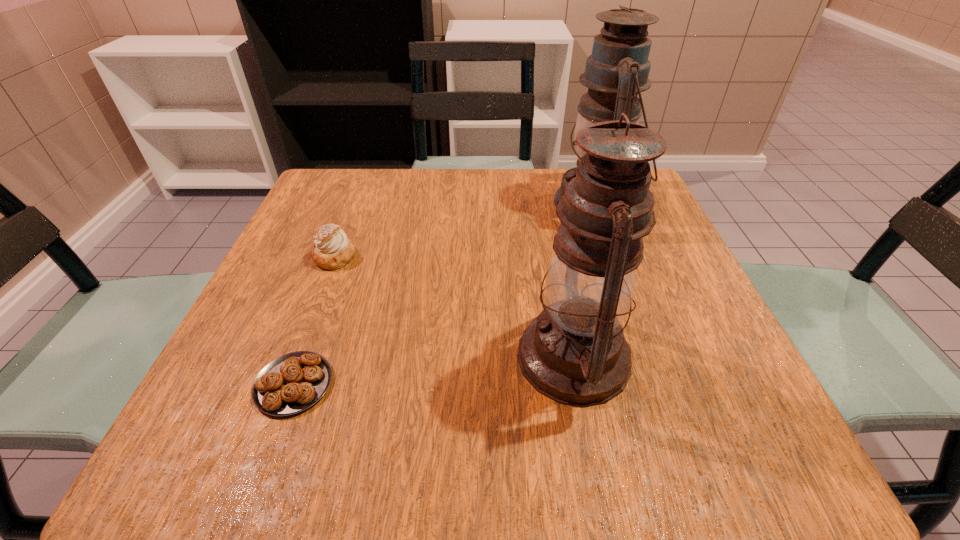
This screenshot has height=540, width=960. Identify the location of object at the far edge. (617, 71).

Find the location of a particular element. The height and width of the screenshot is (540, 960). oil lamp that is at the near edge is located at coordinates (574, 352).

This screenshot has width=960, height=540. In order to click on pastry that is at the near edge in this screenshot , I will do `click(293, 382)`.

Find the location of a particular element. object that is at the right edge is located at coordinates (617, 71).

Locate an element on the screen. The height and width of the screenshot is (540, 960). object present at the near left corner is located at coordinates (293, 382).

This screenshot has height=540, width=960. I want to click on object located at the far right corner, so click(617, 71).

I want to click on vacant space at the far edge of the desktop, so click(485, 202).

In the image, there is a desktop. Where is `free space at the near edge`? free space at the near edge is located at coordinates (442, 446).

In the image, there is a desktop. Where is `free region at the left edge`? free region at the left edge is located at coordinates (274, 287).

Locate an element on the screen. The width and height of the screenshot is (960, 540). free space at the right edge of the desktop is located at coordinates (673, 344).